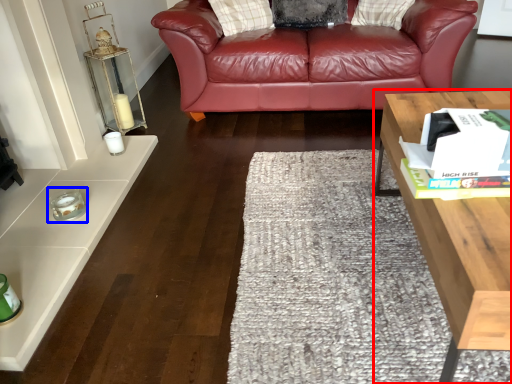
Question: Which object is closer to the camera taking this photo, table (highlighted by a red box) or candle holder (highlighted by a blue box)?

Choices:
 (A) table
 (B) candle holder

Answer: (A)